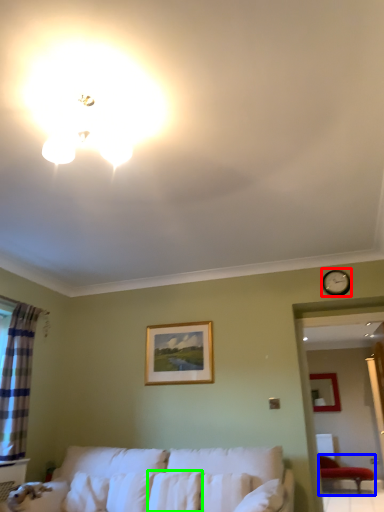
Question: Which object is the closest to the clock (highlighted by a red box)? Choose among these: furniture (highlighted by a blue box) or pillow (highlighted by a green box).

Choices:
 (A) furniture
 (B) pillow

Answer: (B)